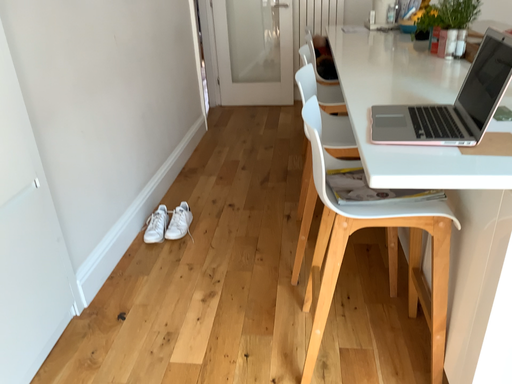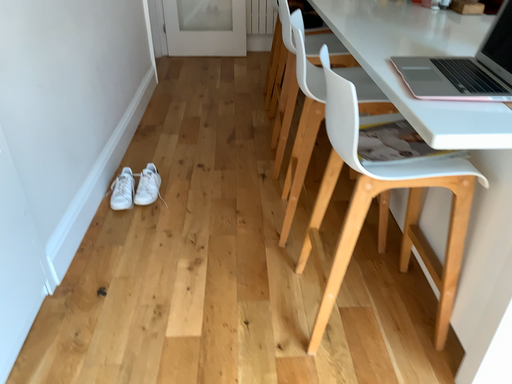
Question: Which way did the camera rotate in the video?

Choices:
 (A) rotated left
 (B) rotated right

Answer: (B)